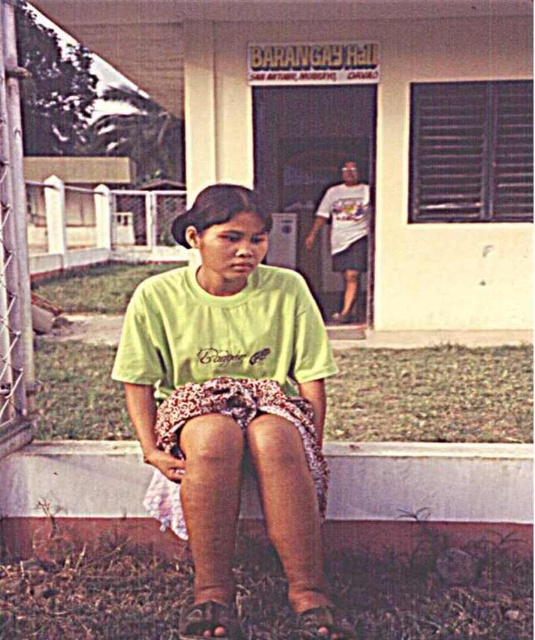
You are standing in front of the barangay hall and notice the green matte shirt at center and the brown concrete curb at lower center. Which object is positioned higher from the ground?

The green matte shirt at center is positioned higher from the ground than the brown concrete curb at lower center because it is stated to be above it.

You are a photographer trying to capture the scene. You want to focus on the green matte shirt at center and the brown concrete curb at lower center. Which object is located to the left of the other?

The green matte shirt at center is positioned on the left side of brown concrete curb at lower center.

Based on the scene described, which object occupies a more prominent visual space in the image? Please consider the green matte shirt at center and the brown concrete curb at lower center in your answer.

The green matte shirt at center has a larger size compared to the brown concrete curb at lower center, making it occupy a more prominent visual space in the image.